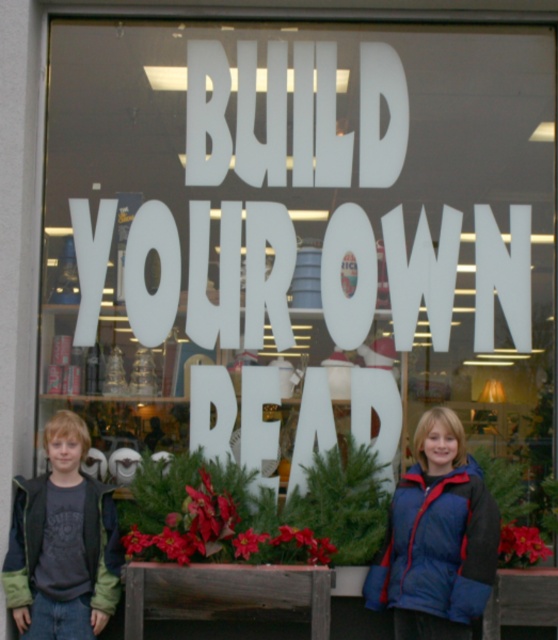
How far apart are blue down jacket at lower right and green fleece jacket at lower left?

They are 1.37 meters apart.

Is blue down jacket at lower right taller than green fleece jacket at lower left?

Correct, blue down jacket at lower right is much taller as green fleece jacket at lower left.

Image resolution: width=558 pixels, height=640 pixels. What are the coordinates of `blue down jacket at lower right` in the screenshot? It's located at (436, 538).